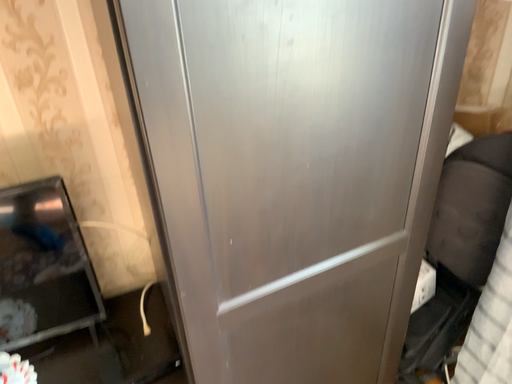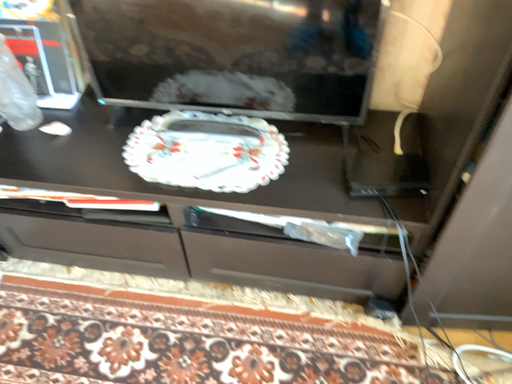
Question: Which way did the camera rotate in the video?

Choices:
 (A) rotated right
 (B) rotated left

Answer: (B)